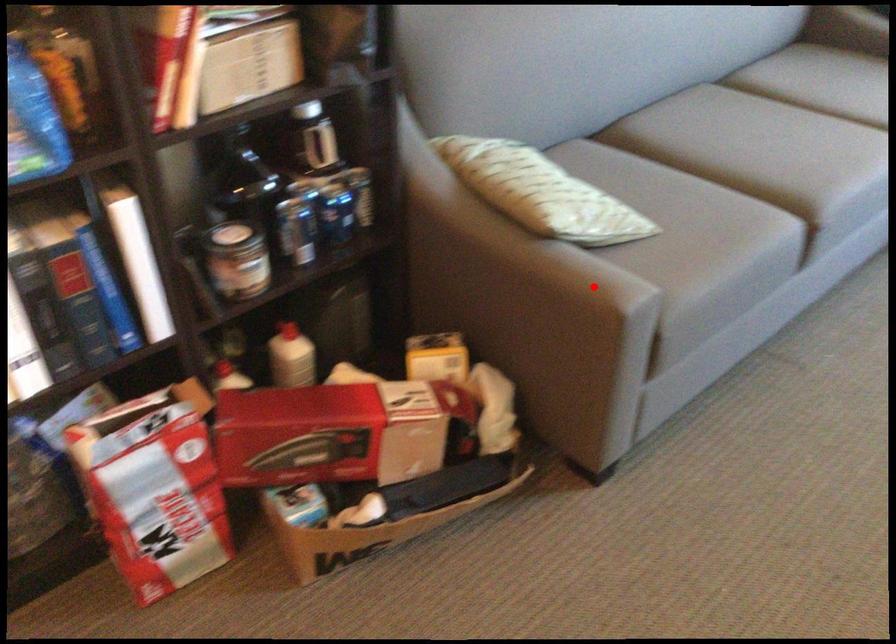
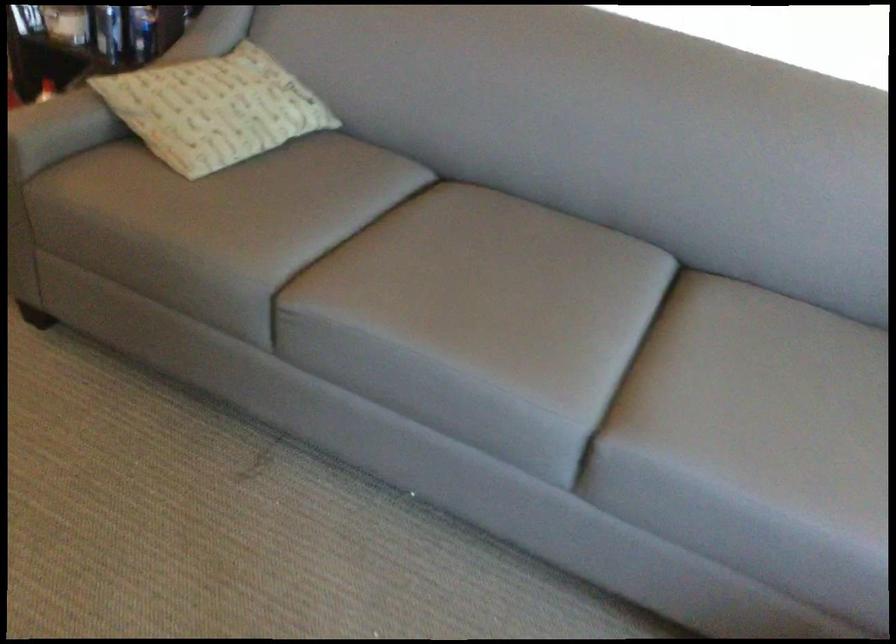
Locate, in the second image, the point that corresponds to the highlighted location in the first image.

(32, 125)